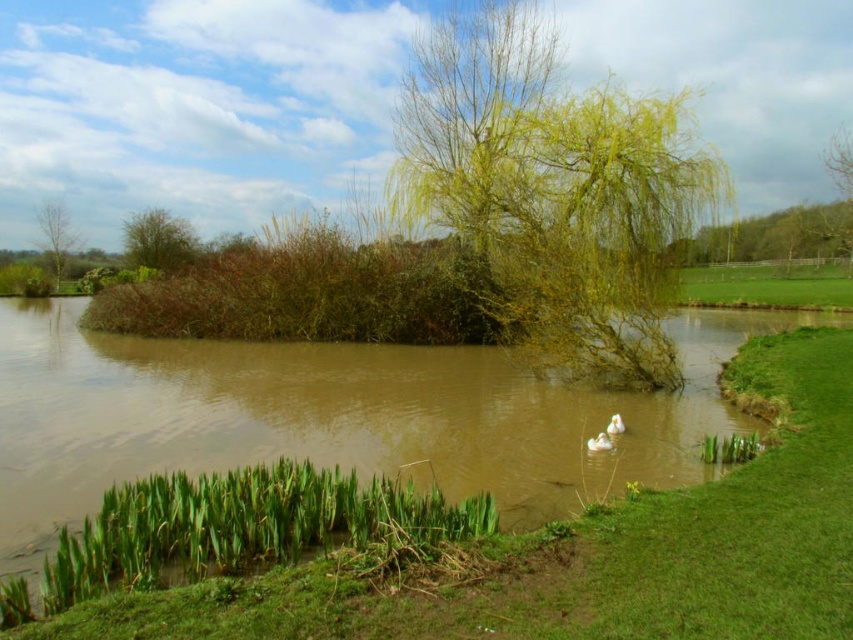
Does green leafy bush at upper left have a smaller size compared to brown leafy tree at upper left?

Yes, green leafy bush at upper left is smaller than brown leafy tree at upper left.

Can you confirm if green leafy bush at upper left is positioned to the left of brown leafy tree at upper left?

Incorrect, green leafy bush at upper left is not on the left side of brown leafy tree at upper left.

Between point (134, 237) and point (62, 248), which one is positioned in front?

Point (62, 248)

Locate an element on the screen. This screenshot has width=853, height=640. green leafy bush at upper left is located at coordinates (160, 241).

Based on the photo, does green grass at center come in front of green leafy tree at upper right?

Yes, green grass at center is in front of green leafy tree at upper right.

Is green grass at center positioned at the back of green leafy tree at upper right?

No, green grass at center is closer to the viewer.

Which is behind, point (647, 492) or point (828, 168)?

Positioned behind is point (828, 168).

Identify the location of green grass at center. (595, 552).

Is point (849, 177) positioned before point (618, 417)?

No, (849, 177) is behind (618, 417).

Who is lower down, green leafy tree at upper right or white matte duck at center?

white matte duck at center is lower down.

Between point (834, 157) and point (619, 433), which one is positioned behind?

Point (834, 157)

I want to click on green leafy tree at upper right, so click(x=840, y=180).